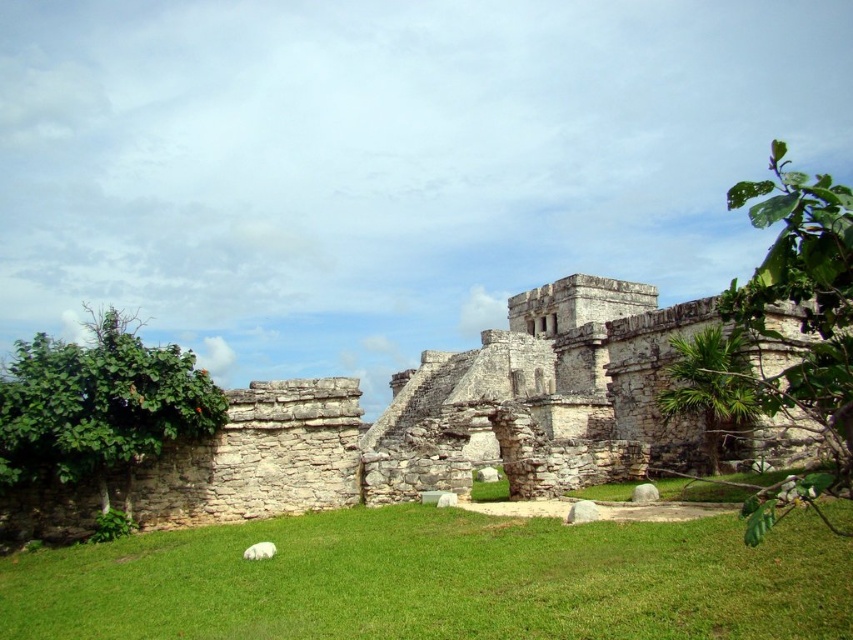
Question: Where is green grass at center located in relation to white fluffy dog at lower left in the image?

Choices:
 (A) below
 (B) above

Answer: (B)

Question: Does green grass at center have a larger size compared to stone ruins at center?

Choices:
 (A) no
 (B) yes

Answer: (A)

Question: Among these points, which one is nearest to the camera?

Choices:
 (A) (583, 436)
 (B) (248, 548)

Answer: (B)

Question: Is green grass at center positioned before white fluffy dog at lower left?

Choices:
 (A) yes
 (B) no

Answer: (A)

Question: Which point is farther to the camera?

Choices:
 (A) (392, 460)
 (B) (264, 547)
 (C) (283, 580)

Answer: (A)

Question: Estimate the real-world distances between objects in this image. Which object is closer to the green grass at center?

Choices:
 (A) stone ruins at center
 (B) white fluffy dog at lower left

Answer: (B)